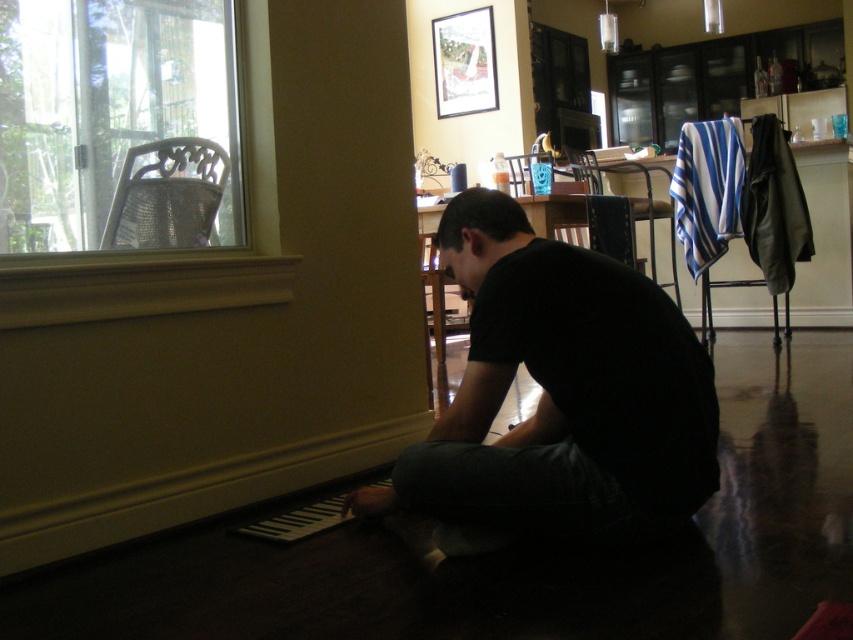
Question: Is black matte shirt at lower center behind clear glass chair at upper left?

Choices:
 (A) yes
 (B) no

Answer: (B)

Question: Which point is farther to the camera?

Choices:
 (A) (167, 188)
 (B) (433, 449)

Answer: (A)

Question: Can you confirm if black matte shirt at lower center is wider than clear glass chair at upper left?

Choices:
 (A) yes
 (B) no

Answer: (B)

Question: In this image, where is black matte shirt at lower center located relative to clear glass chair at upper left?

Choices:
 (A) left
 (B) right

Answer: (B)